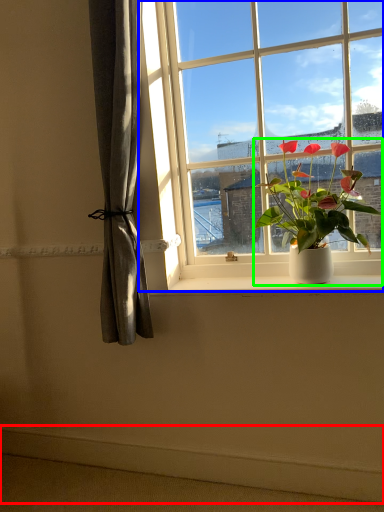
Question: Estimate the real-world distances between objects in this image. Which object is closer to ledge (highlighted by a red box), window (highlighted by a blue box) or houseplant (highlighted by a green box)?

Choices:
 (A) window
 (B) houseplant

Answer: (B)